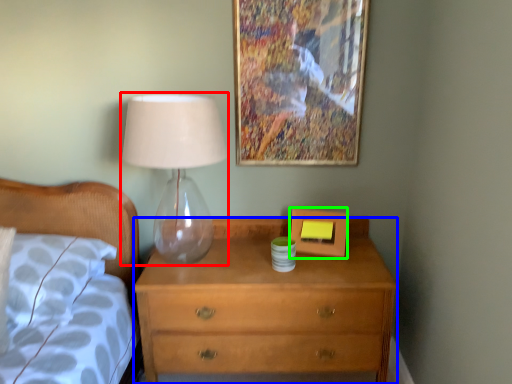
Question: Which is nearer to the table lamp (highlighted by a red box)? chest of drawers (highlighted by a blue box) or picture frame (highlighted by a green box).

Choices:
 (A) chest of drawers
 (B) picture frame

Answer: (B)